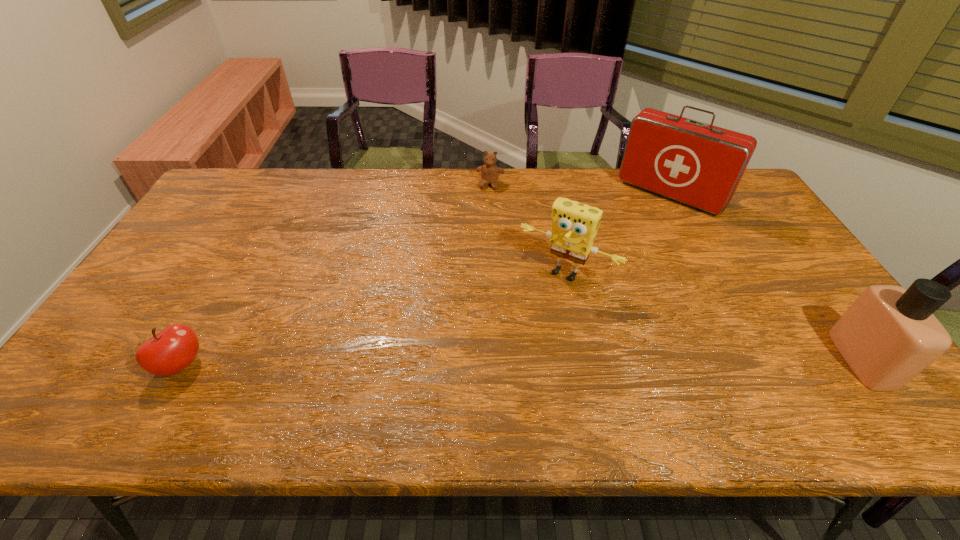
At what (x,y) coordinates should I click in order to perform the action: click on apple. Please return your answer as a coordinate pair (x, y). Looking at the image, I should click on (168, 352).

Image resolution: width=960 pixels, height=540 pixels. I want to click on perfume, so click(x=889, y=335).

This screenshot has height=540, width=960. I want to click on the third object from left to right, so click(x=574, y=225).

At what (x,y) coordinates should I click in order to perform the action: click on sponge. Please return your answer as a coordinate pair (x, y). Looking at the image, I should click on (574, 225).

Where is `the second object from right to left`? The width and height of the screenshot is (960, 540). the second object from right to left is located at coordinates (698, 164).

The height and width of the screenshot is (540, 960). In order to click on the first-aid kit in this screenshot , I will do `click(698, 164)`.

Find the location of `teddy bear`. teddy bear is located at coordinates (490, 172).

The height and width of the screenshot is (540, 960). In order to click on free space located on the back of the apple in this screenshot , I will do `click(251, 241)`.

This screenshot has width=960, height=540. In order to click on vacant space located 0.140m on the face of the third object from right to left in this screenshot , I will do `click(522, 325)`.

Locate an element on the screen. Image resolution: width=960 pixels, height=540 pixels. free point located on the face of the third object from right to left is located at coordinates (487, 379).